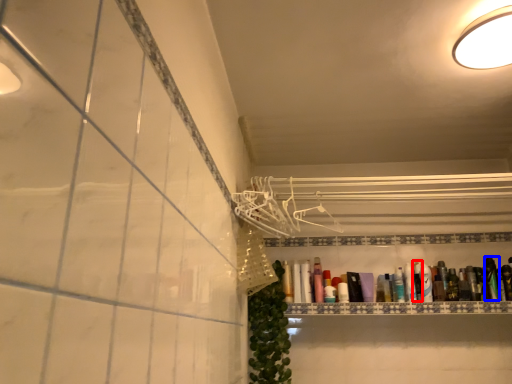
Question: Among these objects, which one is farthest to the camera, toiletry (highlighted by a red box) or toiletry (highlighted by a blue box)?

Choices:
 (A) toiletry
 (B) toiletry

Answer: (A)